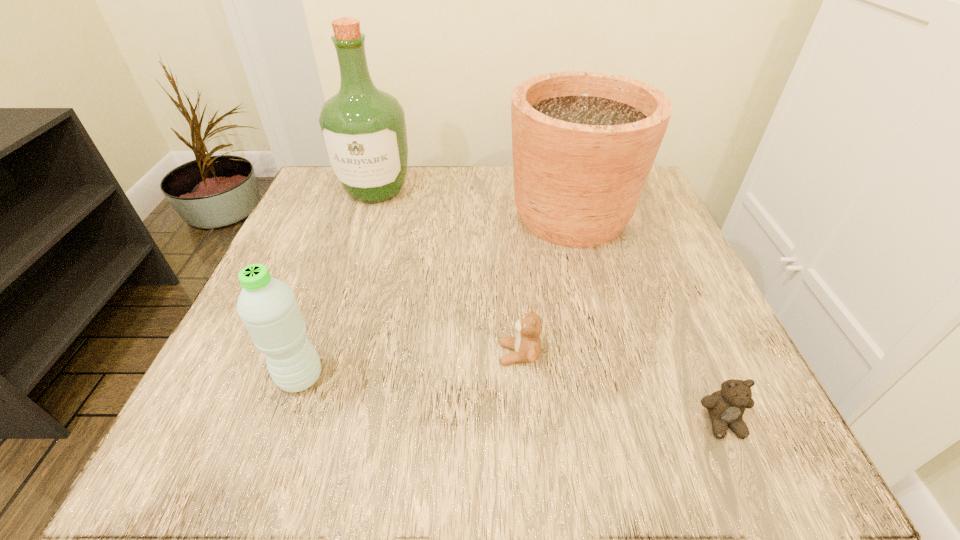
Find the location of a particular element. The height and width of the screenshot is (540, 960). free space located on the front-facing side of the left teddy bear is located at coordinates (429, 354).

Locate an element on the screen. This screenshot has height=540, width=960. vacant point located on the front-facing side of the left teddy bear is located at coordinates (468, 354).

Locate an element on the screen. liquor that is positioned at the far edge is located at coordinates (363, 129).

Where is `flowerpot situated at the far edge`? flowerpot situated at the far edge is located at coordinates (584, 143).

At what (x,y) coordinates should I click in order to perform the action: click on object present at the near edge. Please return your answer as a coordinate pair (x, y). The width and height of the screenshot is (960, 540). Looking at the image, I should click on [726, 407].

I want to click on liquor that is at the left edge, so click(x=363, y=129).

Where is `water bottle that is at the left edge`? The width and height of the screenshot is (960, 540). water bottle that is at the left edge is located at coordinates (268, 308).

Identify the location of flowerpot at the right edge. This screenshot has height=540, width=960. (584, 143).

You are a GUI agent. You are given a task and a screenshot of the screen. Output one action in this format:
    pyautogui.click(x=<x>, y=<y>)
    Task: Click on the teddy bear located in the right edge section of the desktop
    The width and height of the screenshot is (960, 540).
    Given the screenshot: What is the action you would take?
    pyautogui.click(x=726, y=407)

Locate an element on the screen. Image resolution: width=960 pixels, height=540 pixels. object at the far left corner is located at coordinates (363, 129).